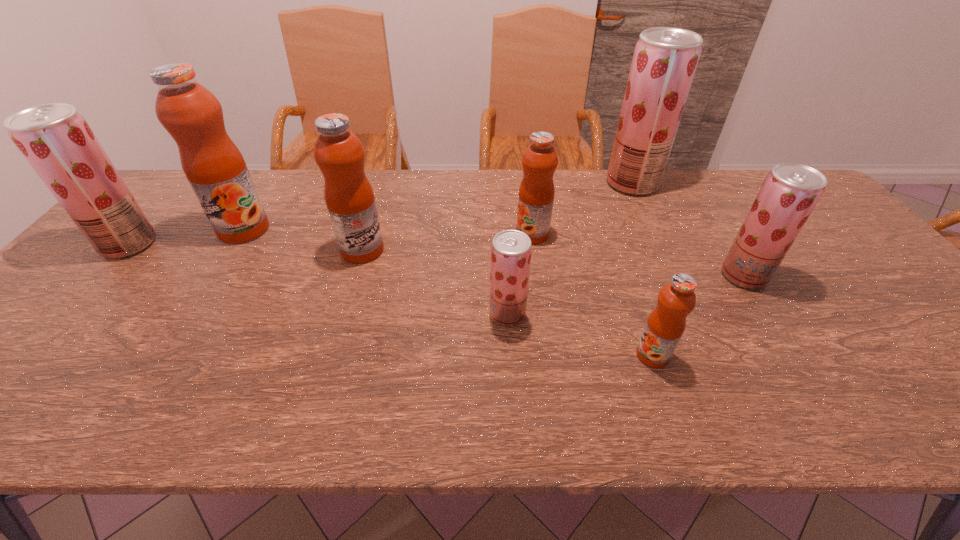
Image resolution: width=960 pixels, height=540 pixels. I want to click on the farthest strawberry fruit juice, so click(665, 59).

You are a GUI agent. You are given a task and a screenshot of the screen. Output one action in this format:
    pyautogui.click(x=<x>, y=<y>)
    Task: Click on the seventh fruit juice from left to right
    
    Given the screenshot: What is the action you would take?
    pyautogui.click(x=665, y=59)

At what (x,y) coordinates should I click in order to perform the action: click on the seventh fruit juice from right to left. Please return your answer as a coordinate pair (x, y). Image resolution: width=960 pixels, height=540 pixels. Looking at the image, I should click on (213, 165).

This screenshot has height=540, width=960. Find the location of `the leftmost orange fruit juice`. the leftmost orange fruit juice is located at coordinates (213, 165).

Locate an element on the screen. Image resolution: width=960 pixels, height=540 pixels. the leftmost object is located at coordinates (56, 140).

You are a GUI agent. You are given a task and a screenshot of the screen. Output one action in this format:
    pyautogui.click(x=<x>, y=<y>)
    Task: Click on the leftmost strawberry fruit juice
    
    Given the screenshot: What is the action you would take?
    pyautogui.click(x=56, y=140)

Image resolution: width=960 pixels, height=540 pixels. I want to click on the third object from left to right, so click(338, 152).

At what (x,y) coordinates should I click in order to perform the action: click on the second biggest orange fruit juice. Please return your answer as a coordinate pair (x, y). The height and width of the screenshot is (540, 960). Looking at the image, I should click on (338, 152).

This screenshot has width=960, height=540. Identify the location of the rightmost fruit juice. (790, 192).

Find the location of a particular element. The width and height of the screenshot is (960, 540). the rightmost strawberry fruit juice is located at coordinates (790, 192).